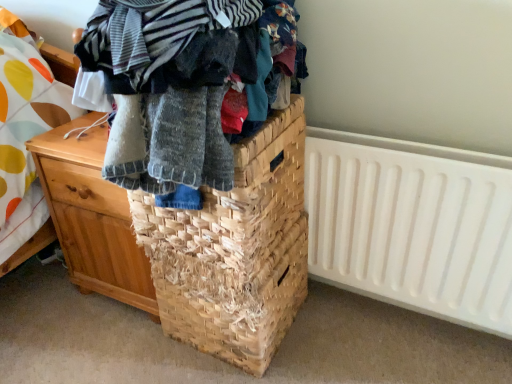
Identify the location of free space to the left of wooden chest of drawers at left. (39, 309).